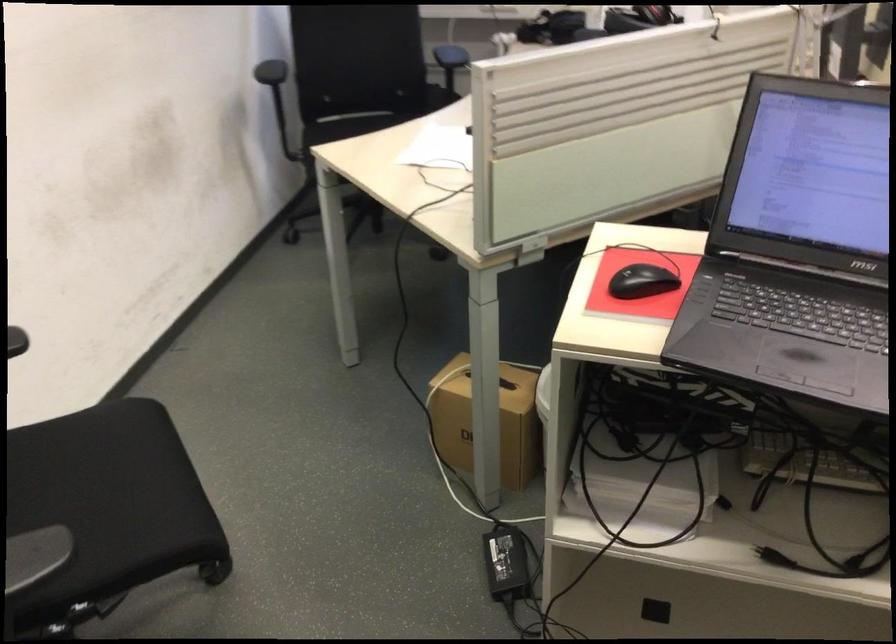
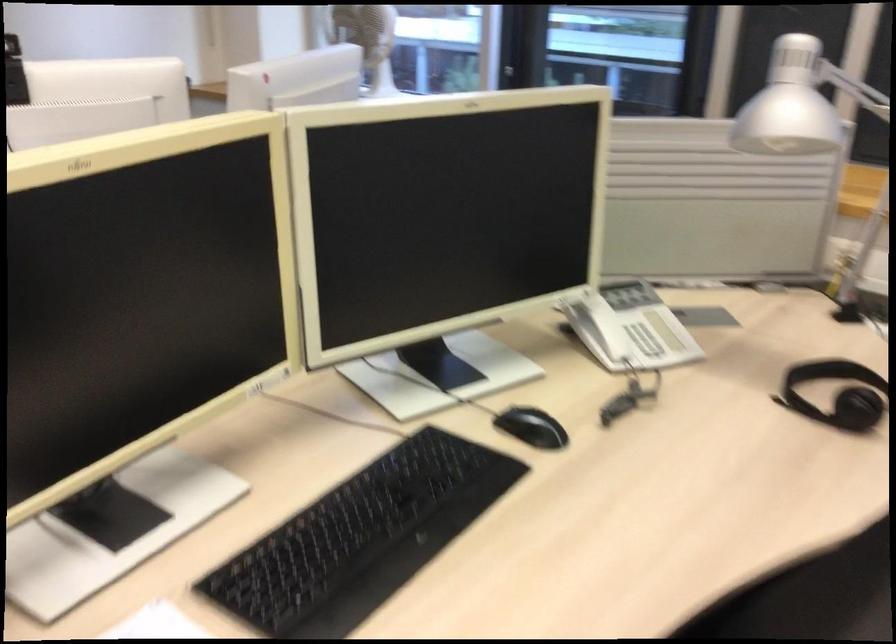
What movement of the cameraman would produce the second image?

The cameraman moved toward right, forward.